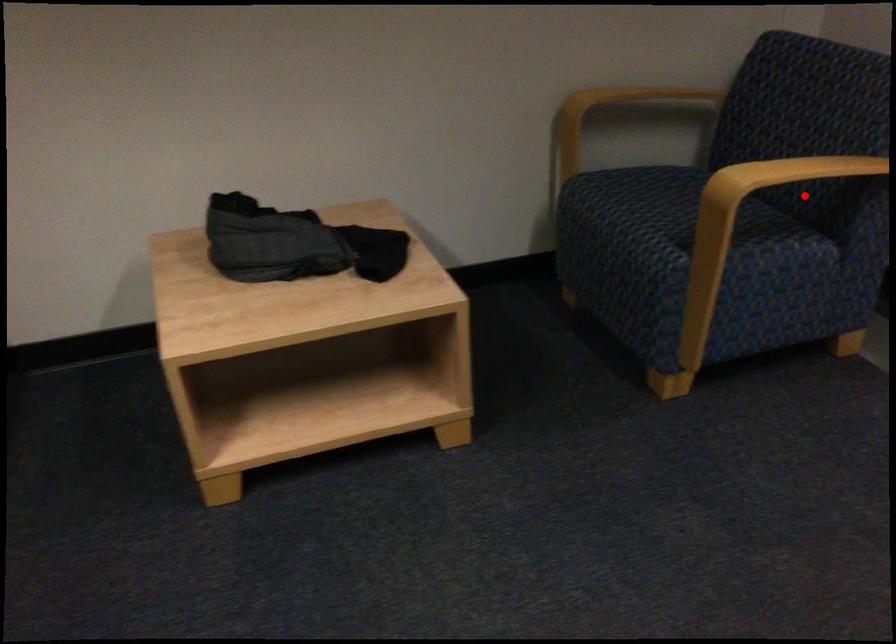
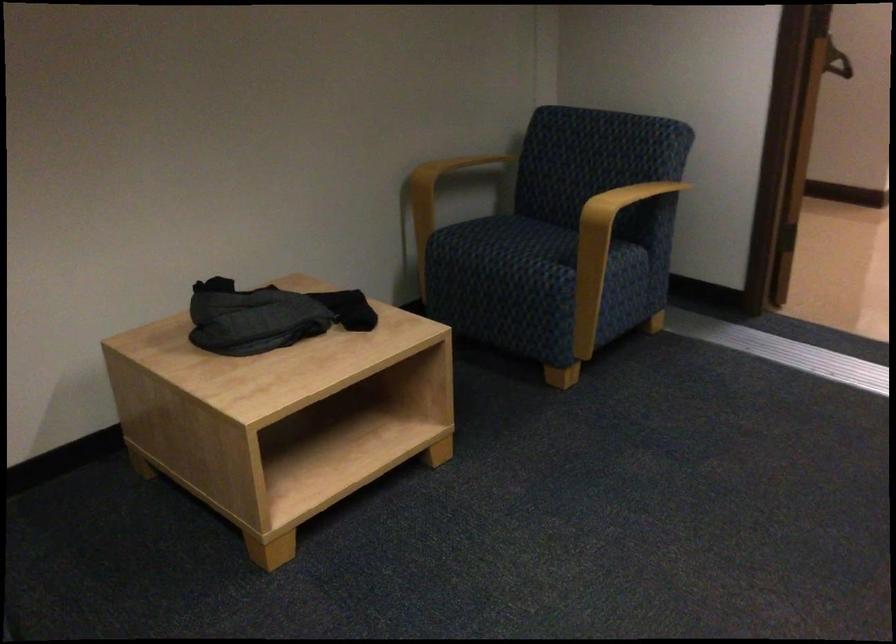
Question: I am providing you with two images of the same scene from different viewpoints. Image1 has a red point marked. In image2, the corresponding 3D location appears at what relative position? Reply with the corresponding letter.

Choices:
 (A) Closer
 (B) Farther

Answer: (B)